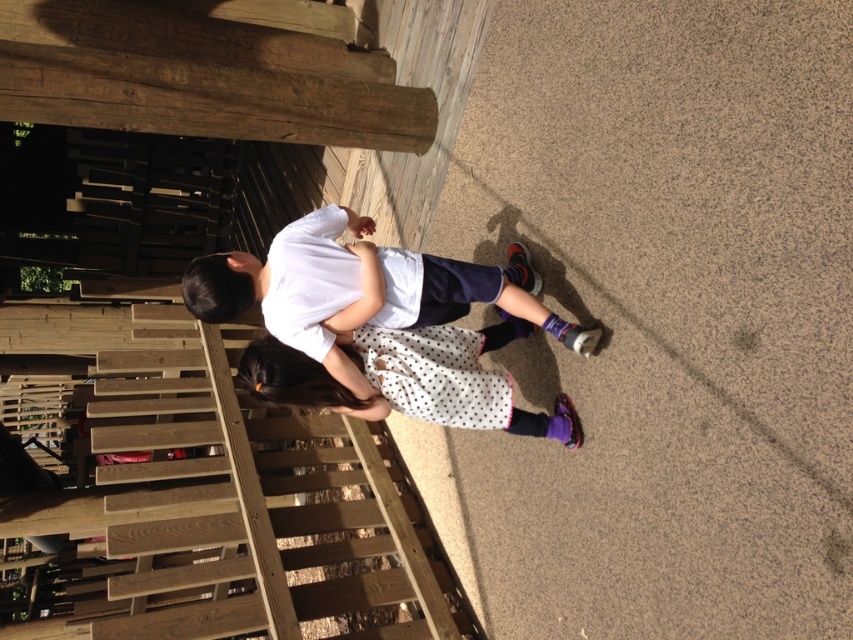
You are standing at the wooden deck and want to walk towards the second child. Which point, point [334,262] or point [397,362], should you step on first?

You should step on point [334,262] first because it is in front of point [397,362].